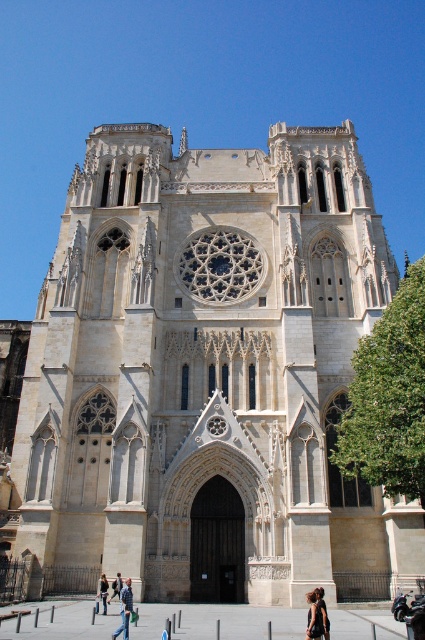
Question: Is dark brown hair at lower center to the right of denim pants at lower left from the viewer's perspective?

Choices:
 (A) no
 (B) yes

Answer: (B)

Question: Which is nearer to the blue denim jeans at lower left?

Choices:
 (A) denim pants at lower left
 (B) dark brown hair at lower center
 (C) black fabric at lower center

Answer: (A)

Question: Which of the following is the closest to the observer?

Choices:
 (A) click(x=102, y=589)
 (B) click(x=129, y=604)
 (C) click(x=325, y=634)
 (D) click(x=116, y=580)

Answer: (C)

Question: Does blue denim jeans at lower left come in front of denim pants at lower left?

Choices:
 (A) yes
 (B) no

Answer: (A)

Question: Among these objects, which one is farthest from the camera?

Choices:
 (A) light brown leather jacket at lower center
 (B) blue denim jeans at lower left
 (C) dark brown hair at lower center

Answer: (A)

Question: Is blue denim jeans at lower left wider than light brown leather jacket at lower center?

Choices:
 (A) yes
 (B) no

Answer: (A)